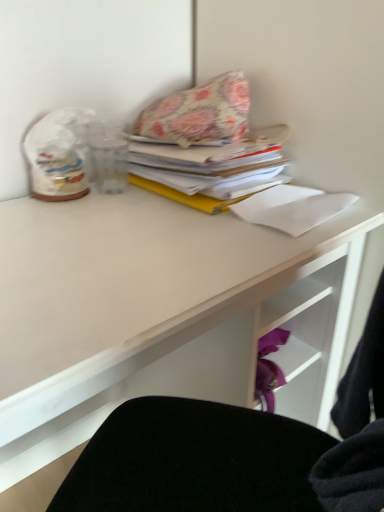
This screenshot has width=384, height=512. Describe the element at coordinates (150, 314) in the screenshot. I see `white matte desk at upper center` at that location.

What is the approximate height of floral fabric pillow at upper center?

5.95 inches.

This screenshot has height=512, width=384. Describe the element at coordinates (291, 208) in the screenshot. I see `white paper at upper right` at that location.

You are a GUI agent. You are given a task and a screenshot of the screen. Output one action in this format:
    pyautogui.click(x=<x>, y=<y>)
    Task: Click on the white matte desk at upper center
    This screenshot has width=384, height=512.
    Given the screenshot: What is the action you would take?
    pyautogui.click(x=150, y=314)

From a real-world perspective, which object stands above the other?

From a 3D spatial view, white paper at upper right is above.

Based on the photo, is white paper at upper right taller than white matte desk at upper center?

In fact, white paper at upper right may be shorter than white matte desk at upper center.

Considering the sizes of objects white paper at upper right and white matte desk at upper center in the image provided, who is thinner, white paper at upper right or white matte desk at upper center?

Thinner between the two is white paper at upper right.

Where is `desk that appears below the floral fabric pillow at upper center (from a real-world perspective)`? desk that appears below the floral fabric pillow at upper center (from a real-world perspective) is located at coordinates (150, 314).

Is white matte desk at upper center inside floral fabric pillow at upper center?

No, white matte desk at upper center is not a part of floral fabric pillow at upper center.

Based on their sizes in the image, would you say floral fabric pillow at upper center is bigger or smaller than white matte desk at upper center?

Clearly, floral fabric pillow at upper center is smaller in size than white matte desk at upper center.

How much distance is there between floral fabric pillow at upper center and white matte desk at upper center?

13.76 inches.

Can you confirm if white paper at upper right is thinner than floral fabric pillow at upper center?

Indeed, white paper at upper right has a lesser width compared to floral fabric pillow at upper center.

Which point is more forward, (314, 191) or (164, 141)?

Point (314, 191)

Can floral fabric pillow at upper center be found inside white paper at upper right?

No, floral fabric pillow at upper center is not a part of white paper at upper right.

Based on the photo, could you tell me if white paper at upper right is facing floral fabric pillow at upper center?

No, white paper at upper right is not oriented towards floral fabric pillow at upper center.

Considering the sizes of white matte desk at upper center and white paper at upper right in the image, is white matte desk at upper center wider or thinner than white paper at upper right?

Clearly, white matte desk at upper center has more width compared to white paper at upper right.

Is white matte desk at upper center smaller than white paper at upper right?

Incorrect, white matte desk at upper center is not smaller in size than white paper at upper right.

Is white matte desk at upper center situated inside white paper at upper right or outside?

white matte desk at upper center is not inside white paper at upper right, it's outside.

In the image, is white matte desk at upper center positioned in front of or behind white paper at upper right?

Clearly, white matte desk at upper center is in front of white paper at upper right.

Measure the distance from floral fabric pillow at upper center to white paper at upper right.

floral fabric pillow at upper center and white paper at upper right are 7.85 inches apart.

From the image's perspective, who appears lower, floral fabric pillow at upper center or white paper at upper right?

white paper at upper right, from the image's perspective.

Between floral fabric pillow at upper center and white paper at upper right, which one appears on the left side from the viewer's perspective?

floral fabric pillow at upper center is more to the left.

From a real-world perspective, is white matte desk at upper center below floral fabric pillow at upper center?

Yes, from a real-world perspective, white matte desk at upper center is below floral fabric pillow at upper center.

Which object is closer to the camera taking this photo, white matte desk at upper center or floral fabric pillow at upper center?

white matte desk at upper center.

Is floral fabric pillow at upper center a part of white matte desk at upper center?

No, floral fabric pillow at upper center is not inside white matte desk at upper center.

Which is more to the right, white matte desk at upper center or floral fabric pillow at upper center?

floral fabric pillow at upper center.

At what (x,y) coordinates should I click in order to perform the action: click on paper that appears on the right of white matte desk at upper center. Please return your answer as a coordinate pair (x, y). Looking at the image, I should click on (291, 208).

The width and height of the screenshot is (384, 512). What are the coordinates of `desk in front of the floral fabric pillow at upper center` in the screenshot? It's located at (150, 314).

Estimate the real-world distances between objects in this image. Which object is further from floral fabric pillow at upper center, white matte desk at upper center or white paper at upper right?

white matte desk at upper center.

Estimate the real-world distances between objects in this image. Which object is further from white matte desk at upper center, white paper at upper right or floral fabric pillow at upper center?

floral fabric pillow at upper center.

Which object lies further to the anchor point white paper at upper right, white matte desk at upper center or floral fabric pillow at upper center?

The object further to white paper at upper right is white matte desk at upper center.

Considering their positions, is floral fabric pillow at upper center positioned closer to white matte desk at upper center than white paper at upper right?

Among the two, white paper at upper right is located nearer to white matte desk at upper center.

From the image, which object appears to be nearer to floral fabric pillow at upper center, white paper at upper right or white matte desk at upper center?

The object closer to floral fabric pillow at upper center is white paper at upper right.

Estimate the real-world distances between objects in this image. Which object is further from white paper at upper right, floral fabric pillow at upper center or white matte desk at upper center?

white matte desk at upper center.

Where is `paper between floral fabric pillow at upper center and white matte desk at upper center from top to bottom`? The height and width of the screenshot is (512, 384). paper between floral fabric pillow at upper center and white matte desk at upper center from top to bottom is located at coordinates (291, 208).